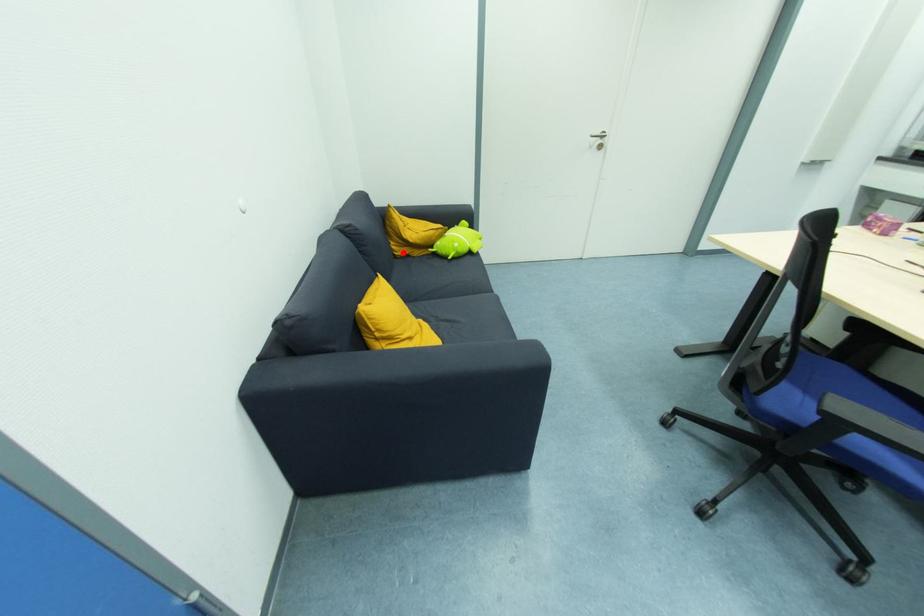
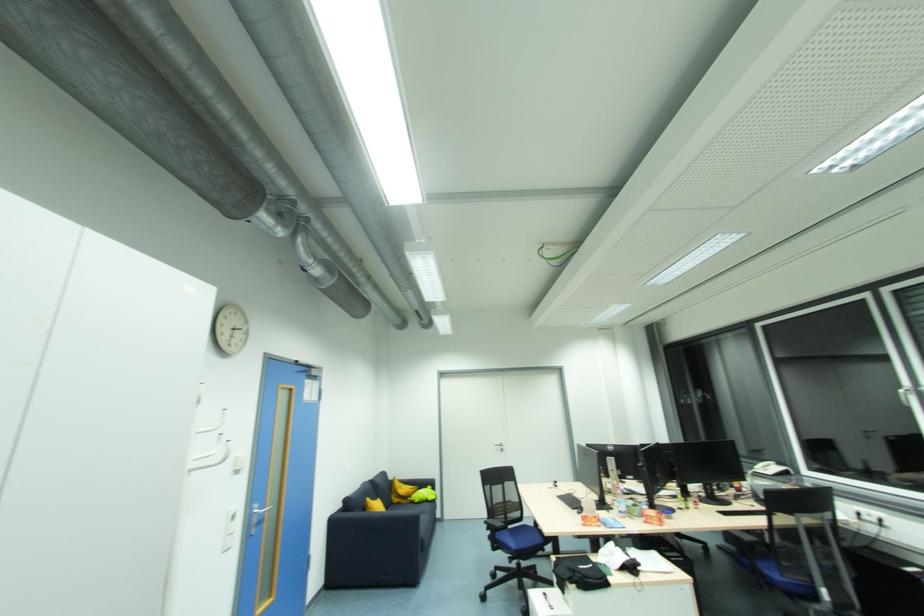
Question: I am providing you with two images of the same scene from different viewpoints. In image1, a red point is highlighted. Considering the same 3D point in image2, which of the following is correct?

Choices:
 (A) It is closer
 (B) It is farther

Answer: (B)